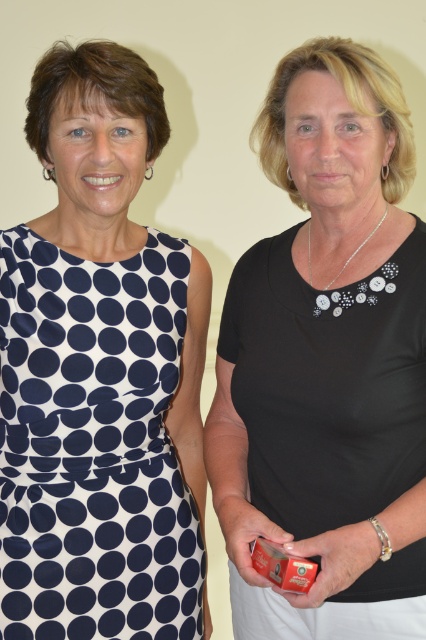
Question: Can you confirm if black matte shirt at center is positioned below navy blue polka dot fabric dress at left?

Choices:
 (A) no
 (B) yes

Answer: (A)

Question: Is black matte shirt at center bigger than navy blue polka dot fabric dress at left?

Choices:
 (A) no
 (B) yes

Answer: (B)

Question: Which point is farther to the camera?

Choices:
 (A) navy blue polka dot fabric dress at left
 (B) black matte shirt at center

Answer: (A)

Question: Which object appears closest to the camera in this image?

Choices:
 (A) navy blue polka dot fabric dress at left
 (B) black matte shirt at center

Answer: (B)

Question: Does black matte shirt at center appear under navy blue polka dot fabric dress at left?

Choices:
 (A) no
 (B) yes

Answer: (A)